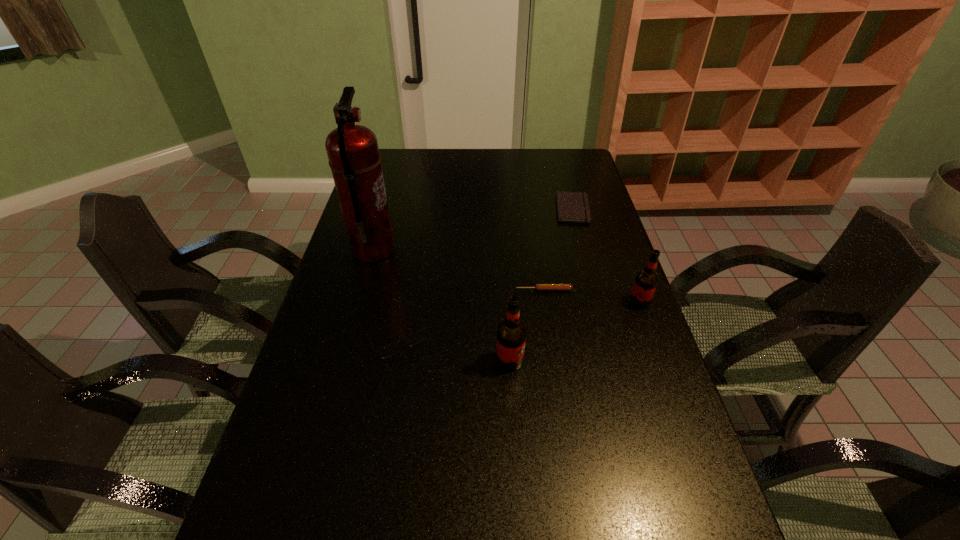
Find the location of a particular element. The width and height of the screenshot is (960, 540). vacant region that satisfies the following two spatial constraints: 1. on the nozzle side of the second shortest object; 2. on the left side of the fire extinguisher is located at coordinates (362, 290).

At what (x,y) coordinates should I click in order to perform the action: click on vacant area that satisfies the following two spatial constraints: 1. on the back side of the fourth shortest object; 2. on the right side of the nearer root beer. Please return your answer as a coordinate pair (x, y). Looking at the image, I should click on (506, 302).

The height and width of the screenshot is (540, 960). Find the location of `free spot that satisfies the following two spatial constraints: 1. on the nozzle side of the fire extinguisher; 2. on the left side of the second shortest object`. free spot that satisfies the following two spatial constraints: 1. on the nozzle side of the fire extinguisher; 2. on the left side of the second shortest object is located at coordinates (362, 290).

At what (x,y) coordinates should I click in order to perform the action: click on vacant space that satisfies the following two spatial constraints: 1. with the lenses facing outward on the spectacles; 2. on the left side of the nearer root beer. Please return your answer as a coordinate pair (x, y). The width and height of the screenshot is (960, 540). Looking at the image, I should click on (395, 361).

The image size is (960, 540). Find the location of `vacant space that satisfies the following two spatial constraints: 1. with the lenses facing outward on the nearer root beer; 2. on the left side of the third shortest object`. vacant space that satisfies the following two spatial constraints: 1. with the lenses facing outward on the nearer root beer; 2. on the left side of the third shortest object is located at coordinates (395, 361).